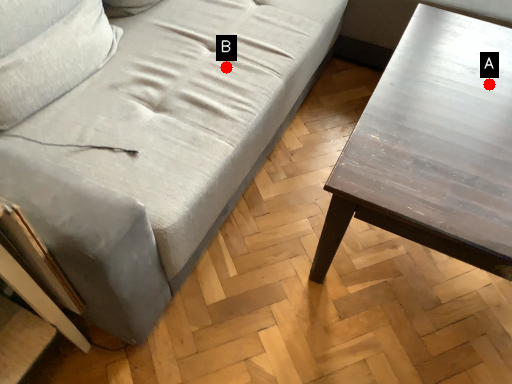
Question: Two points are circled on the image, labeled by A and B beside each circle. Which point is farther from the camera taking this photo?

Choices:
 (A) A is further
 (B) B is further

Answer: (B)